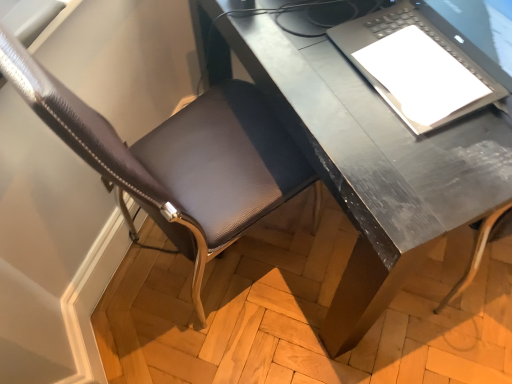
You are a GUI agent. You are given a task and a screenshot of the screen. Output one action in this format:
    pyautogui.click(x=<x>, y=<y>)
    Task: Click on the free point in front of matte black laptop at upper right
    Image resolution: width=512 pixels, height=384 pixels.
    Given the screenshot: What is the action you would take?
    (x=428, y=158)